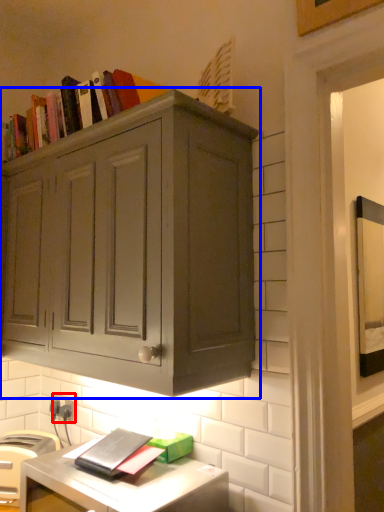
Question: Which object appears farthest to the camera in this image, electric outlet (highlighted by a red box) or cabinetry (highlighted by a blue box)?

Choices:
 (A) electric outlet
 (B) cabinetry

Answer: (A)